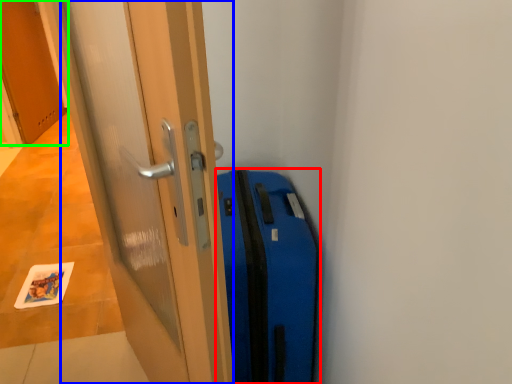
Question: Which is farther away from suitcase (highlighted by a red box)? door (highlighted by a blue box) or door (highlighted by a green box)?

Choices:
 (A) door
 (B) door

Answer: (B)